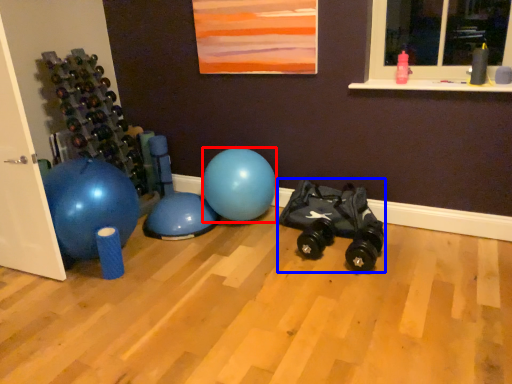
Question: Which object is closer to the camera taking this photo, ball (highlighted by a red box) or toy car (highlighted by a blue box)?

Choices:
 (A) ball
 (B) toy car

Answer: (B)